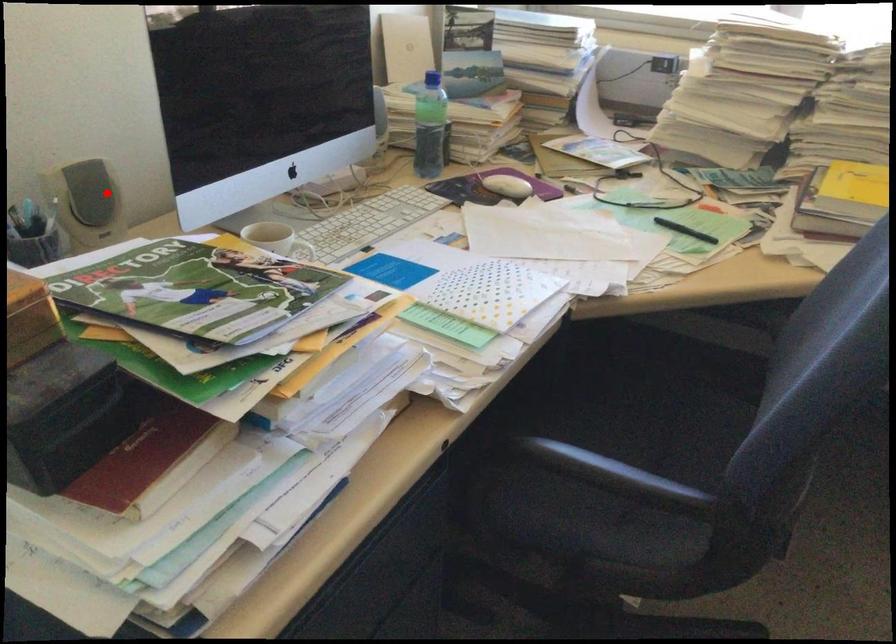
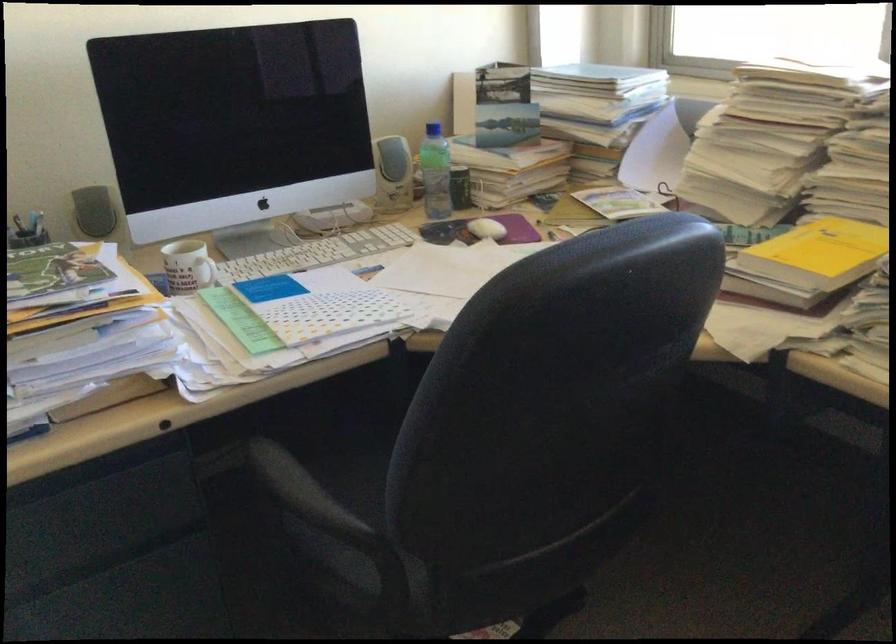
Question: I am providing you with two images of the same scene from different viewpoints. A red point is marked on the first image. Can you still see the location of the red point in image 2?

Choices:
 (A) Yes
 (B) No

Answer: (A)